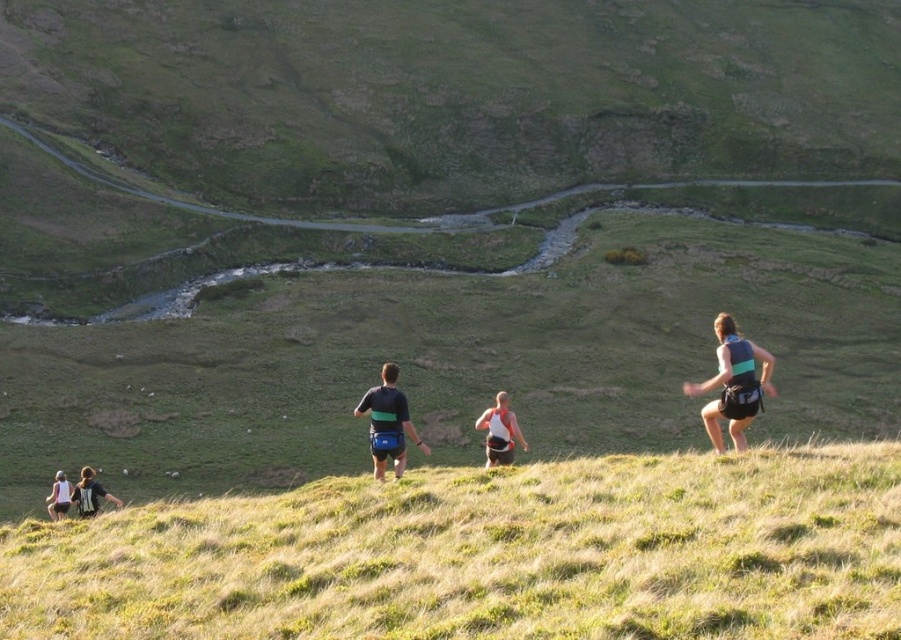
Can you confirm if white fabric tank top at center is taller than matte black backpack at lower left?

Yes.

Who is taller, white fabric tank top at center or matte black backpack at lower left?

white fabric tank top at center is taller.

Identify the location of white fabric tank top at center. The height and width of the screenshot is (640, 901). tap(499, 432).

You are a GUI agent. You are given a task and a screenshot of the screen. Output one action in this format:
    pyautogui.click(x=<x>, y=<y>)
    Task: Click on the white fabric tank top at center
    The image size is (901, 640).
    Given the screenshot: What is the action you would take?
    pyautogui.click(x=499, y=432)

Which is below, green grassy hillside at center or white fabric tank top at lower left?

white fabric tank top at lower left is lower down.

Does green grassy hillside at center have a lesser width compared to white fabric tank top at lower left?

In fact, green grassy hillside at center might be wider than white fabric tank top at lower left.

This screenshot has width=901, height=640. Describe the element at coordinates (488, 556) in the screenshot. I see `green grassy hillside at center` at that location.

Find the location of `green grassy hillside at center`. green grassy hillside at center is located at coordinates [x=488, y=556].

Does green fabric vest at right come behind matte black backpack at lower left?

That is False.

Does point (745, 387) lie in front of point (96, 493)?

Yes, it is.

Locate an element on the screen. This screenshot has height=640, width=901. green fabric vest at right is located at coordinates (733, 385).